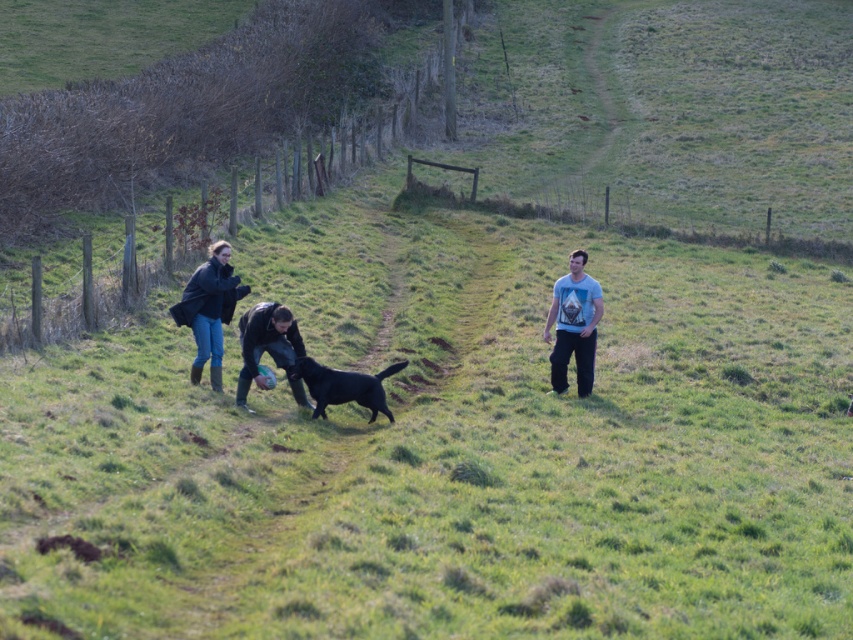
You are standing in the field and want to give a treat to the black glossy dog at center. To your right, there is a fence. Which direction should you move to reach the matte black jacket at center before approaching the dog?

You should move to your left because the matte black jacket at center is located to the left of the black glossy dog at center. Since the fence is to your right, moving left will allow you to first reach the matte black jacket at center before approaching the dog.

In the scene shown: You are standing at the origin point of the coordinate system where the bottom left corner is the origin. The field is represented as a grid. Where is the matte black jacket at center located in terms of coordinates?

The matte black jacket at center is located at coordinates point (265, 342).

You are standing in the field and want to throw a ball to the black glossy dog at center. To ensure the ball reaches the dog, should you aim towards the matte black jacket at center or behind it?

You should aim behind the matte black jacket at center because it is closer to you than the black glossy dog at center, so throwing behind it will allow the ball to reach the dog.